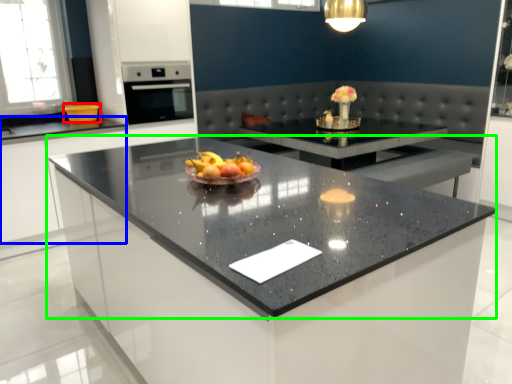
Question: Which object is positioned farthest from kitchen appliance (highlighted by a red box)? Select from cabinetry (highlighted by a blue box) and countertop (highlighted by a green box).

Choices:
 (A) cabinetry
 (B) countertop

Answer: (B)